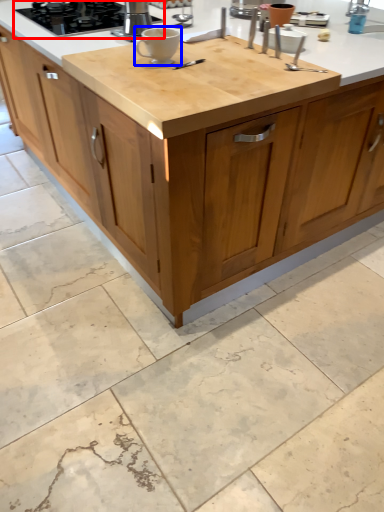
Question: Which object appears farthest to the camera in this image, gas stove (highlighted by a red box) or coffee cup (highlighted by a blue box)?

Choices:
 (A) gas stove
 (B) coffee cup

Answer: (A)